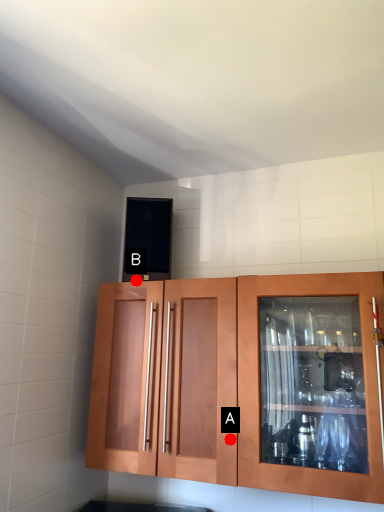
Question: Two points are circled on the image, labeled by A and B beside each circle. Among these points, which one is farthest from the camera?

Choices:
 (A) A is further
 (B) B is further

Answer: (B)